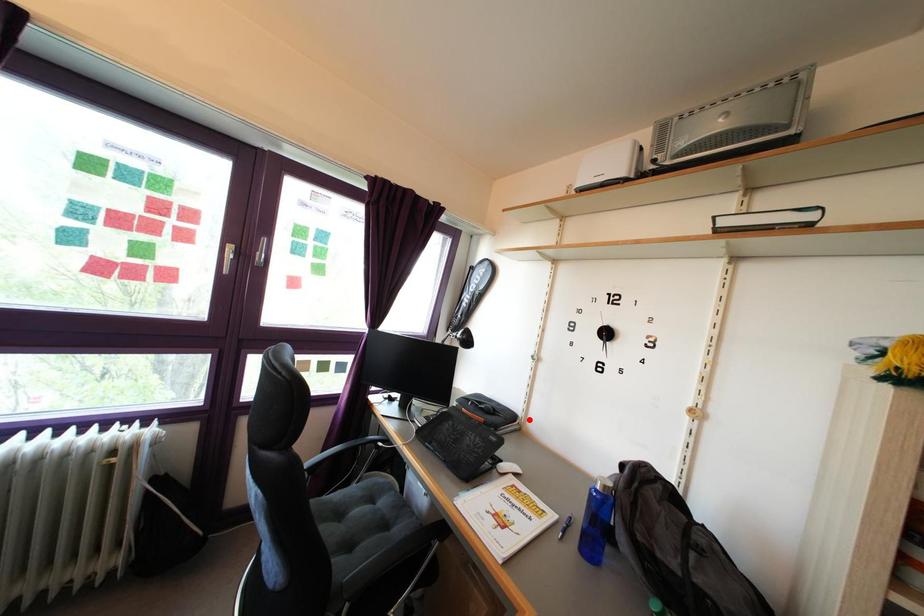
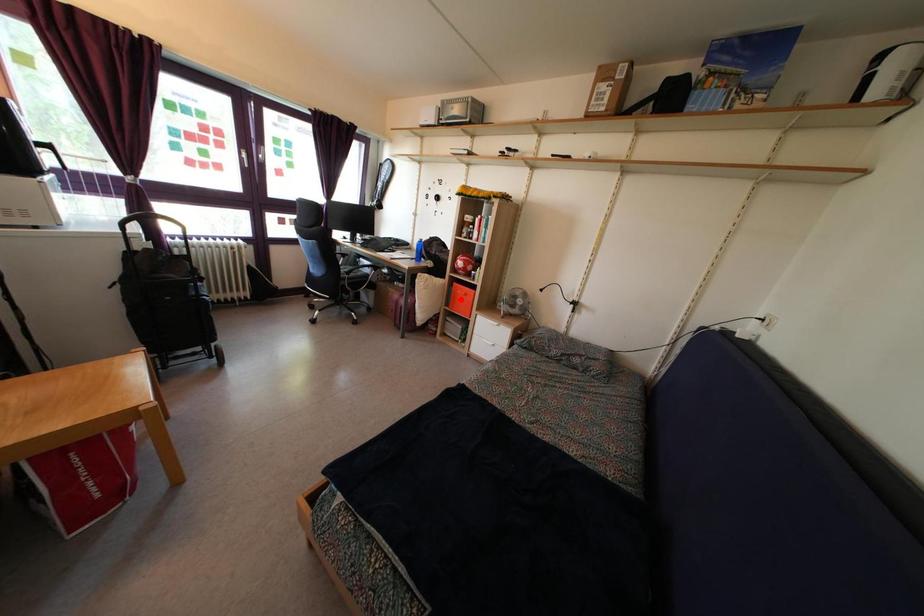
I am providing you with two images of the same scene from different viewpoints. A red point is marked on the first image and another point is marked on the second image. Do the highlighted points in image1 and image2 indicate the same real-world spot?

No